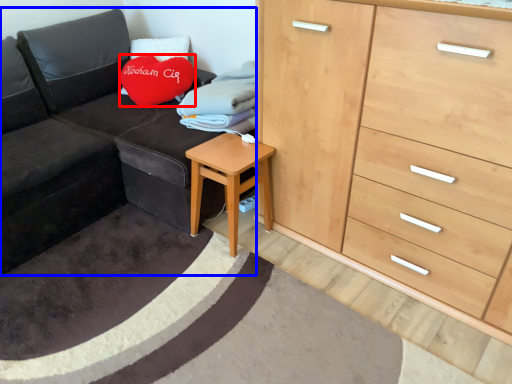
Question: Among these objects, which one is farthest to the camera, throw pillow (highlighted by a red box) or studio couch (highlighted by a blue box)?

Choices:
 (A) throw pillow
 (B) studio couch

Answer: (A)